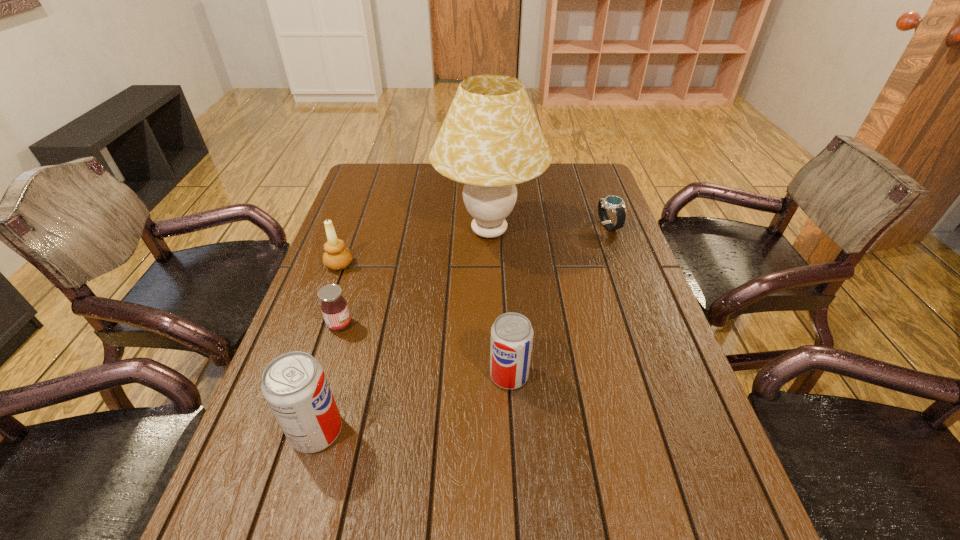
This screenshot has height=540, width=960. In order to click on vacant area that lies between the farther soda and the lampshade in this screenshot , I will do `click(499, 303)`.

Where is `unoccupied position between the jam and the rightmost object`? unoccupied position between the jam and the rightmost object is located at coordinates (473, 275).

This screenshot has width=960, height=540. I want to click on free space between the shorter soda and the jam, so click(424, 350).

Image resolution: width=960 pixels, height=540 pixels. Identify the location of free area in between the nearer soda and the rightmost object. (462, 328).

At what (x,y) coordinates should I click in order to perform the action: click on free spot between the candle_holder and the tallest object. Please return your answer as a coordinate pair (x, y). The image size is (960, 540). Looking at the image, I should click on (415, 248).

Select which object is the fifth closest to the rightmost object. Please provide its 2D coordinates. Your answer should be formatted as a tuple, i.e. [(x, y)], where the tuple contains the x and y coordinates of a point satisfying the conditions above.

[(294, 384)]

Locate an element on the screen. the fifth closest object relative to the candle_holder is located at coordinates (616, 204).

Identify the location of vacant space that satisfies the following two spatial constraints: 1. on the label side of the nearer soda; 2. on the right side of the third nearest object. The height and width of the screenshot is (540, 960). (306, 431).

Identify the location of vacant region that satisfies the following two spatial constraints: 1. on the back side of the fifth farthest object; 2. on the label side of the jam. The image size is (960, 540). (506, 325).

This screenshot has width=960, height=540. Identify the location of vacant area that satisfies the following two spatial constraints: 1. on the label side of the fifth farthest object; 2. on the right side of the jam. [x=324, y=375].